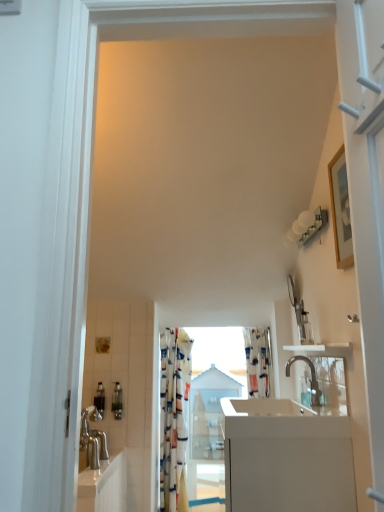
At what (x,y) coordinates should I click in order to perform the action: click on clear glass mirror at right. Please return your answer as a coordinate pair (x, y). Looking at the image, I should click on tap(331, 385).

What do you see at coordinates (331, 385) in the screenshot?
I see `clear glass mirror at right` at bounding box center [331, 385].

Identify the location of white glossy counter at center. (286, 458).

This screenshot has width=384, height=512. In order to click on metallic silver soap dispenser at lower left, which ranks as the 1th toiletry in left-to-right order in this screenshot , I will do `click(100, 399)`.

Describe the element at coordinates (173, 414) in the screenshot. This screenshot has width=384, height=512. I see `patterned fabric curtain at center` at that location.

Image resolution: width=384 pixels, height=512 pixels. I want to click on clear glass mirror at right, so click(x=331, y=385).

Is metallic silver soap dispenser at lower left, which ranks as the second toiletry in right-to-left order, at the left side of white glossy counter at center?

Yes, metallic silver soap dispenser at lower left, which ranks as the second toiletry in right-to-left order, is to the left of white glossy counter at center.

Which of these two, metallic silver soap dispenser at lower left, which ranks as the 1th toiletry in left-to-right order, or white glossy counter at center, is wider?

With larger width is white glossy counter at center.

Is white glossy counter at center completely or partially inside metallic silver soap dispenser at lower left, which ranks as the 1th toiletry in left-to-right order?

No, white glossy counter at center is not inside metallic silver soap dispenser at lower left, which ranks as the 1th toiletry in left-to-right order.

Does metallic silver soap dispenser at lower left, arranged as the 2th toiletry when viewed from the left, have a smaller size compared to clear glass mirror at right?

Yes, metallic silver soap dispenser at lower left, arranged as the 2th toiletry when viewed from the left, is smaller than clear glass mirror at right.

Which is correct: metallic silver soap dispenser at lower left, the first toiletry from the right, is inside clear glass mirror at right, or outside of it?

metallic silver soap dispenser at lower left, the first toiletry from the right, exists outside the volume of clear glass mirror at right.

From a real-world perspective, is metallic silver soap dispenser at lower left, the first toiletry from the right, positioned above or below clear glass mirror at right?

metallic silver soap dispenser at lower left, the first toiletry from the right, is situated lower than clear glass mirror at right in the real world.

Is white glossy sink at lower center facing towards metallic silver soap dispenser at lower left, the first toiletry from the right?

No.

From a real-world perspective, between white glossy sink at lower center and metallic silver soap dispenser at lower left, arranged as the 2th toiletry when viewed from the left, who is vertically higher?

metallic silver soap dispenser at lower left, arranged as the 2th toiletry when viewed from the left.

From the image's perspective, would you say white glossy sink at lower center is shown under metallic silver soap dispenser at lower left, arranged as the 2th toiletry when viewed from the left?

No.

In the scene shown: Is white glossy counter at center spatially inside metallic silver soap dispenser at lower left, the first toiletry from the right, or outside of it?

white glossy counter at center lies outside metallic silver soap dispenser at lower left, the first toiletry from the right.

Is white glossy counter at center behind metallic silver soap dispenser at lower left, the first toiletry from the right?

No, white glossy counter at center is closer to the camera.

Which object is wider, white glossy counter at center or metallic silver soap dispenser at lower left, arranged as the 2th toiletry when viewed from the left?

Wider between the two is white glossy counter at center.

Measure the distance from white glossy sink at lower center to printed fabric shower curtain at center.

3.55 feet.

From a real-world perspective, is white glossy sink at lower center beneath printed fabric shower curtain at center?

Indeed, from a real-world perspective, white glossy sink at lower center is positioned beneath printed fabric shower curtain at center.

Is white glossy sink at lower center at the left side of printed fabric shower curtain at center?

Correct, you'll find white glossy sink at lower center to the left of printed fabric shower curtain at center.

Based on the photo, from the image's perspective, is white glossy sink at lower center on printed fabric shower curtain at center?

Indeed, from the image's perspective, white glossy sink at lower center is shown above printed fabric shower curtain at center.

From the image's perspective, is clear glass mirror at right positioned above or below polished chrome faucet at center?

From the image's perspective, clear glass mirror at right appears above polished chrome faucet at center.

From a real-world perspective, which is physically below, clear glass mirror at right or polished chrome faucet at center?

polished chrome faucet at center.

Is clear glass mirror at right positioned beyond the bounds of polished chrome faucet at center?

Yes, clear glass mirror at right is located beyond the bounds of polished chrome faucet at center.

Is clear glass mirror at right facing away from metallic silver soap dispenser at lower left, which ranks as the second toiletry in right-to-left order?

No, clear glass mirror at right is not facing away from metallic silver soap dispenser at lower left, which ranks as the second toiletry in right-to-left order.

Is clear glass mirror at right positioned behind metallic silver soap dispenser at lower left, which ranks as the second toiletry in right-to-left order?

That is False.

How much distance is there between clear glass mirror at right and metallic silver soap dispenser at lower left, which ranks as the second toiletry in right-to-left order?

4.41 feet.

Considering the sizes of clear glass mirror at right and metallic silver soap dispenser at lower left, which ranks as the 1th toiletry in left-to-right order, in the image, is clear glass mirror at right wider or thinner than metallic silver soap dispenser at lower left, which ranks as the 1th toiletry in left-to-right order,?

In the image, clear glass mirror at right appears to be more narrow than metallic silver soap dispenser at lower left, which ranks as the 1th toiletry in left-to-right order.

In order to click on counter in front of the metallic silver soap dispenser at lower left, which ranks as the 1th toiletry in left-to-right order in this screenshot , I will do `click(286, 458)`.

You are a GUI agent. You are given a task and a screenshot of the screen. Output one action in this format:
    pyautogui.click(x=<x>, y=<y>)
    Task: Click on the mirror above the metallic silver soap dispenser at lower left, arranged as the 2th toiletry when viewed from the left (from the image's perspective)
    The width and height of the screenshot is (384, 512).
    Given the screenshot: What is the action you would take?
    pyautogui.click(x=331, y=385)

Estimate the real-world distances between objects in this image. Which object is closer to patterned fabric curtain at center, printed fabric shower curtain at center or polished chrome faucet at center?

printed fabric shower curtain at center is positioned closer to the anchor patterned fabric curtain at center.

When comparing their distances from patterned fabric curtain at center, does white glossy counter at center or polished chrome faucet at center seem further?

Among the two, white glossy counter at center is located further to patterned fabric curtain at center.

Consider the image. From the image, which object appears to be nearer to white glossy sink at lower center, patterned fabric curtain at center or white glossy counter at center?

white glossy counter at center lies closer to white glossy sink at lower center than the other object.

From the image, which object appears to be nearer to printed fabric shower curtain at center, patterned fabric curtain at center or white glossy counter at center?

patterned fabric curtain at center is positioned closer to the anchor printed fabric shower curtain at center.

Estimate the real-world distances between objects in this image. Which object is further from clear glass mirror at right, metallic silver soap dispenser at lower left, which ranks as the 1th toiletry in left-to-right order, or white glossy counter at center?

Based on the image, metallic silver soap dispenser at lower left, which ranks as the 1th toiletry in left-to-right order, appears to be further to clear glass mirror at right.

Based on their spatial positions, is white glossy sink at lower center or clear glass mirror at right further from metallic silver soap dispenser at lower left, which ranks as the second toiletry in right-to-left order?

clear glass mirror at right is positioned further to the anchor metallic silver soap dispenser at lower left, which ranks as the second toiletry in right-to-left order.

Based on their spatial positions, is printed fabric shower curtain at center or white glossy sink at lower center further from patterned fabric curtain at center?

Based on the image, white glossy sink at lower center appears to be further to patterned fabric curtain at center.

Estimate the real-world distances between objects in this image. Which object is closer to white glossy sink at lower center, white glossy counter at center or patterned fabric curtain at center?

white glossy counter at center is positioned closer to the anchor white glossy sink at lower center.

The width and height of the screenshot is (384, 512). What are the coordinates of `tap between clear glass mirror at right and printed fabric shower curtain at center along the z-axis` in the screenshot? It's located at (311, 378).

Image resolution: width=384 pixels, height=512 pixels. What are the coordinates of `tap between white glossy sink at lower center and patterned fabric curtain at center in the front-back direction` in the screenshot? It's located at (311, 378).

The image size is (384, 512). What are the coordinates of `tap between white glossy counter at center and metallic silver soap dispenser at lower left, arranged as the 2th toiletry when viewed from the left, along the z-axis` in the screenshot? It's located at (311, 378).

The width and height of the screenshot is (384, 512). Identify the location of toiletry located between white glossy sink at lower center and metallic silver soap dispenser at lower left, which ranks as the 1th toiletry in left-to-right order, in the depth direction. (117, 401).